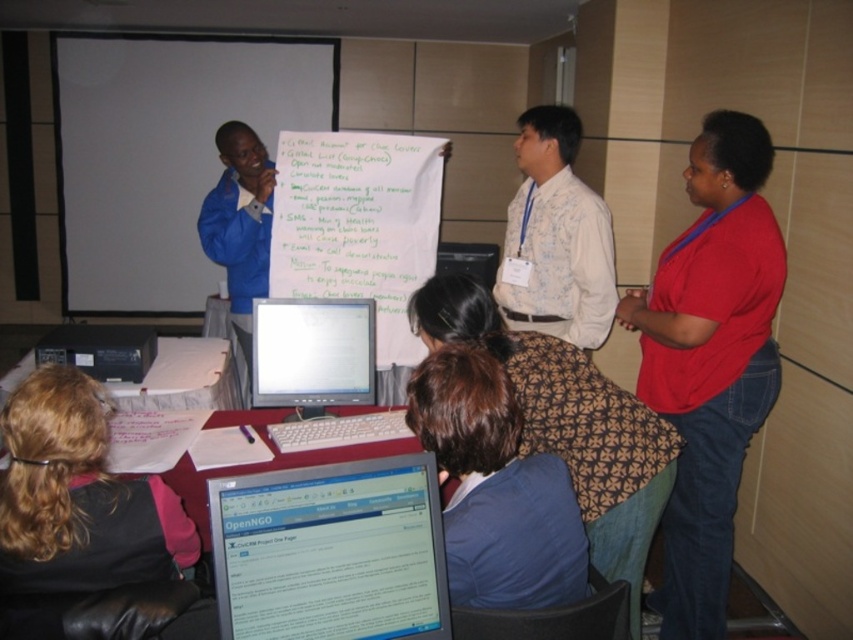
You are a participant in the presentation and need to write down notes on the white paperboard at upper left. Where exactly should you stand to write on it?

The white paperboard at upper left is located at point coordinates of 0.242 on the x axis and 0.193 on the y axis. To write on it, you should stand directly in front of these coordinates.

You are standing in the room and need to pass a document to the person wearing the blue fabric jacket at upper left from the red matte shirt at right. Considering the distance between them, is it possible to throw the document directly without it hitting any obstacles?

The distance between the red matte shirt at right and the blue fabric jacket at upper left is 5.62 feet. Since there are no obstacles mentioned in the scene description, it is possible to throw the document directly.